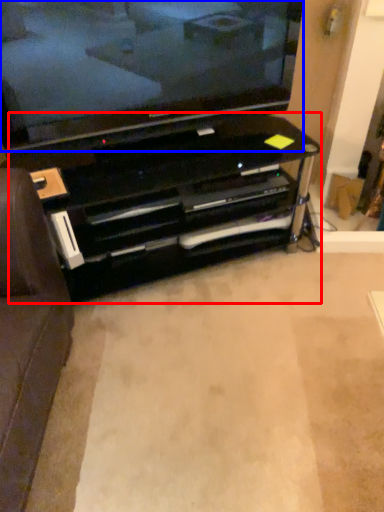
Question: Which of the following is the closest to the observer, entertainment center (highlighted by a red box) or television (highlighted by a blue box)?

Choices:
 (A) entertainment center
 (B) television

Answer: (B)